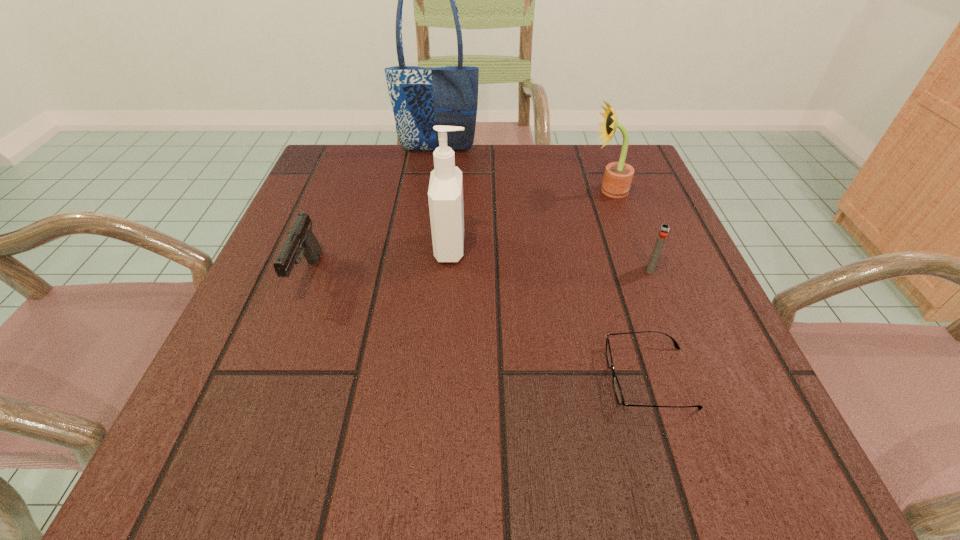
The image size is (960, 540). I want to click on vacant region located 0.110m on the front label of the cleansing agent, so click(525, 247).

Locate an element on the screen. vacant space situated 0.100m on the face of the sunflower is located at coordinates click(544, 191).

This screenshot has width=960, height=540. I want to click on vacant space located on the face of the sunflower, so click(431, 191).

You are a GUI agent. You are given a task and a screenshot of the screen. Output one action in this format:
    pyautogui.click(x=<x>, y=<y>)
    Task: Click on the free space located 0.230m on the face of the sunflower
    
    Given the screenshot: What is the action you would take?
    pyautogui.click(x=486, y=191)

Locate an element on the screen. free space located 0.080m aim along the barrel of the leftmost object is located at coordinates (281, 345).

Image resolution: width=960 pixels, height=540 pixels. I want to click on vacant space located on the left of the igniter, so click(x=469, y=269).

Where is `free region located 0.180m on the front-facing side of the nearest object`? free region located 0.180m on the front-facing side of the nearest object is located at coordinates (484, 377).

Where is `free space located 0.280m on the front-facing side of the nearest object`? This screenshot has width=960, height=540. free space located 0.280m on the front-facing side of the nearest object is located at coordinates 415,377.

Where is `vacant space located on the front-facing side of the nearest object`? vacant space located on the front-facing side of the nearest object is located at coordinates (415, 377).

Find the location of `shopping bag that is positioned at the far edge`. shopping bag that is positioned at the far edge is located at coordinates (421, 98).